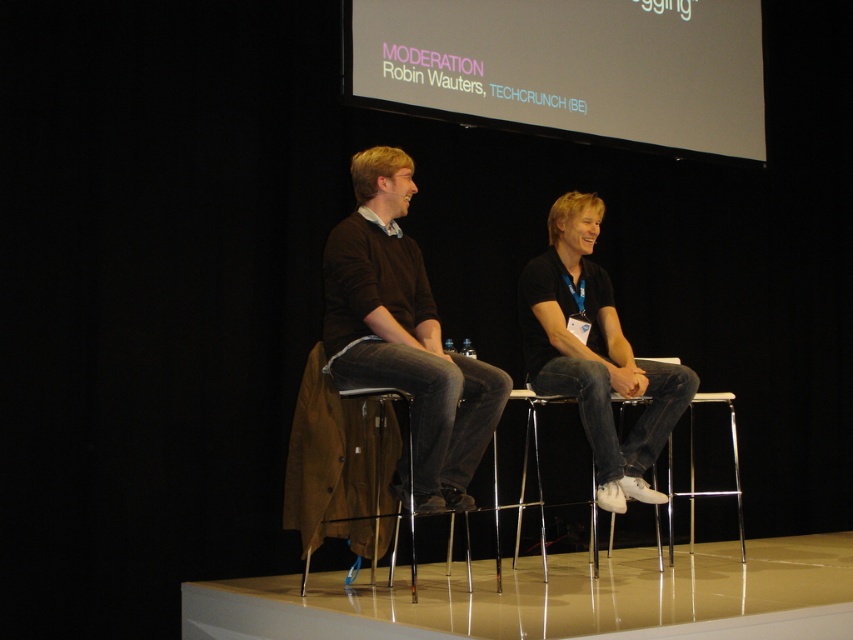
Question: Does white matte projection screen at upper center have a smaller size compared to matte brown sweater at center?

Choices:
 (A) yes
 (B) no

Answer: (B)

Question: Which point is farther to the camera?

Choices:
 (A) white matte projection screen at upper center
 (B) black matte shirt at center

Answer: (A)

Question: Considering the real-world distances, which object is farthest from the black matte shirt at center?

Choices:
 (A) white matte projection screen at upper center
 (B) matte brown sweater at center

Answer: (A)

Question: Which object is farther from the camera taking this photo?

Choices:
 (A) white matte projection screen at upper center
 (B) black matte shirt at center
 (C) matte brown sweater at center

Answer: (A)

Question: Does matte brown sweater at center have a larger size compared to black matte shirt at center?

Choices:
 (A) yes
 (B) no

Answer: (B)

Question: Considering the relative positions of matte brown sweater at center and black matte shirt at center in the image provided, where is matte brown sweater at center located with respect to black matte shirt at center?

Choices:
 (A) right
 (B) left

Answer: (B)